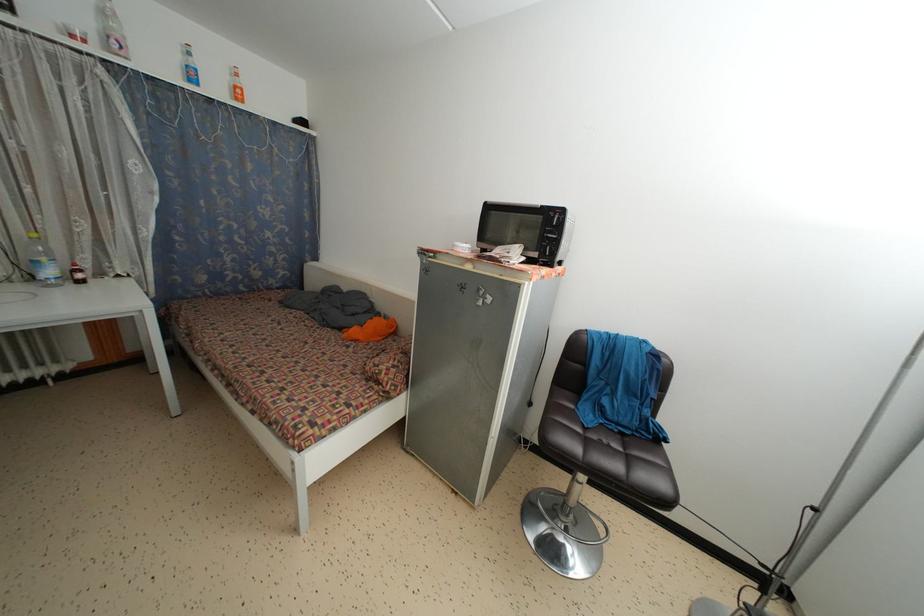
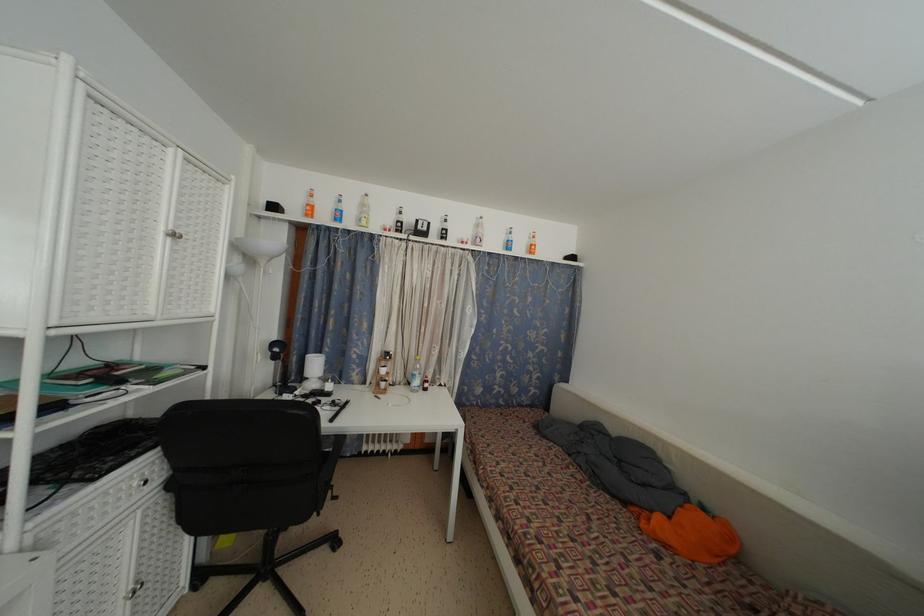
The point at (55, 278) is marked in the first image. Where is the corresponding point in the second image?

(420, 387)